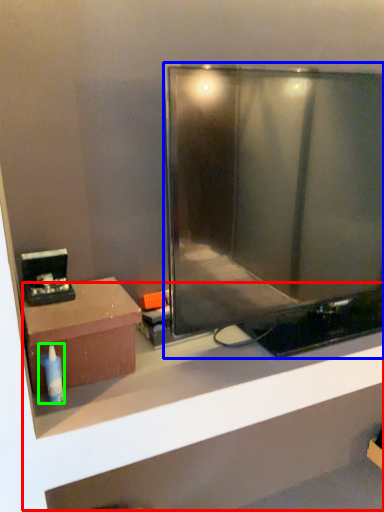
Question: Based on their relative distances, which object is nearer to shelf (highlighted by a red box)? Choose from television (highlighted by a blue box) and toiletry (highlighted by a green box).

Choices:
 (A) television
 (B) toiletry

Answer: (A)